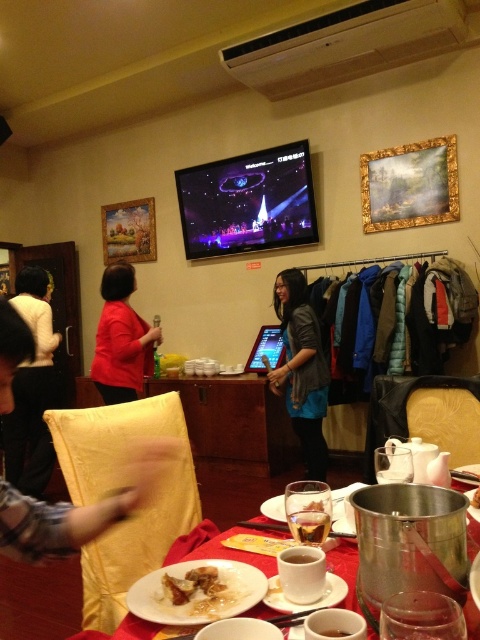
Question: Is gold-framed painting at upper right below gold-framed painting at upper left?

Choices:
 (A) yes
 (B) no

Answer: (B)

Question: Is gold-framed painting at upper left further to the viewer compared to white ceramic plate at center?

Choices:
 (A) no
 (B) yes

Answer: (B)

Question: Which of these objects is positioned farthest from the black leather jacket at left?

Choices:
 (A) metallic silver pot at center
 (B) porcelain plate at center
 (C) gold-framed painting at upper right
 (D) white ceramic plate at center

Answer: (D)

Question: Which point appears farthest from the camera in this image?

Choices:
 (A) (336, 582)
 (B) (36, 342)
 (C) (181, 582)
 (D) (136, 352)

Answer: (D)

Question: Which point is closer to the camera taking this photo?

Choices:
 (A) (334, 580)
 (B) (43, 268)
 (C) (128, 385)
 (D) (474, 496)

Answer: (A)

Question: Can you confirm if black leather jacket at left is wider than white ceramic plate at center?

Choices:
 (A) no
 (B) yes

Answer: (B)